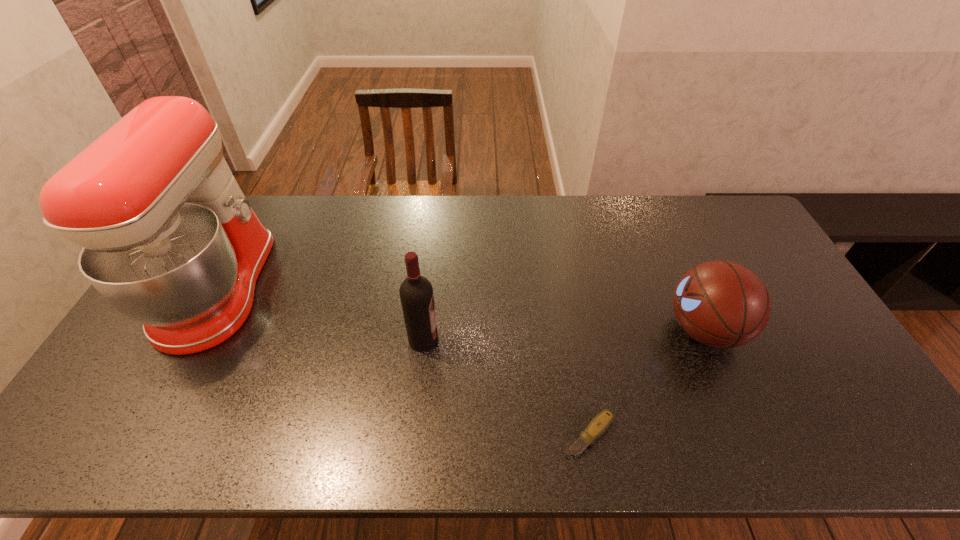
Find the location of a particular element. vacant space situated 0.400m on the left of the third tallest object is located at coordinates (524, 330).

Identify the location of vacant position located on the left of the pocketknife. The image size is (960, 540). 477,434.

Find the location of a particular element. object that is at the far edge is located at coordinates (169, 240).

This screenshot has width=960, height=540. What are the coordinates of `object that is at the near edge` in the screenshot? It's located at (600, 423).

Locate an element on the screen. This screenshot has height=540, width=960. object at the left edge is located at coordinates (169, 240).

Where is `object at the far left corner`? object at the far left corner is located at coordinates (169, 240).

Locate an element on the screen. Image resolution: width=960 pixels, height=540 pixels. free region at the far edge of the desktop is located at coordinates (376, 222).

In the image, there is a desktop. Identify the location of vacant space at the near edge. The image size is (960, 540). (792, 434).

Where is `free space at the right edge`? free space at the right edge is located at coordinates click(x=788, y=302).

At what (x,y) coordinates should I click in order to perform the action: click on free area in between the pocketknife and the second object from left to right. Please return your answer as a coordinate pair (x, y). Looking at the image, I should click on (506, 387).